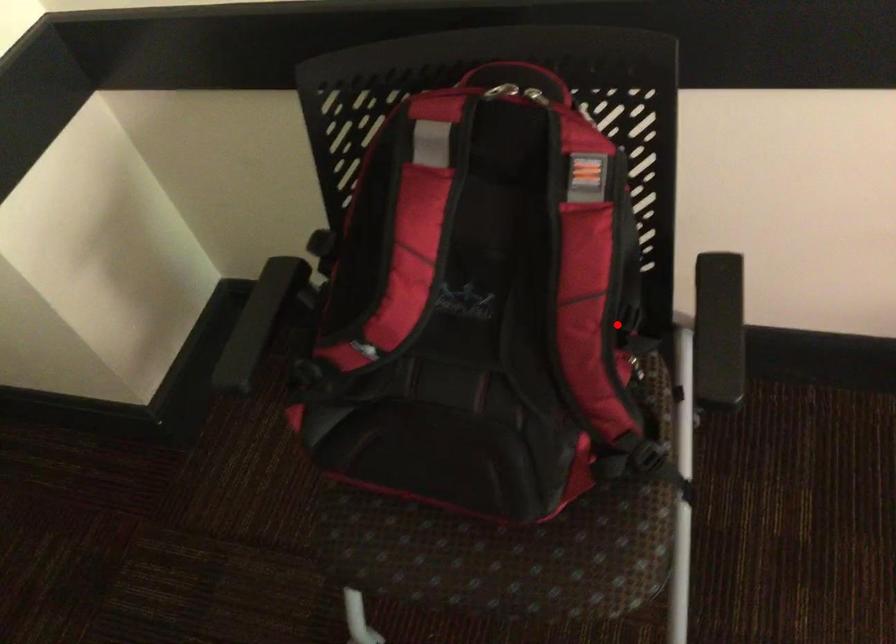
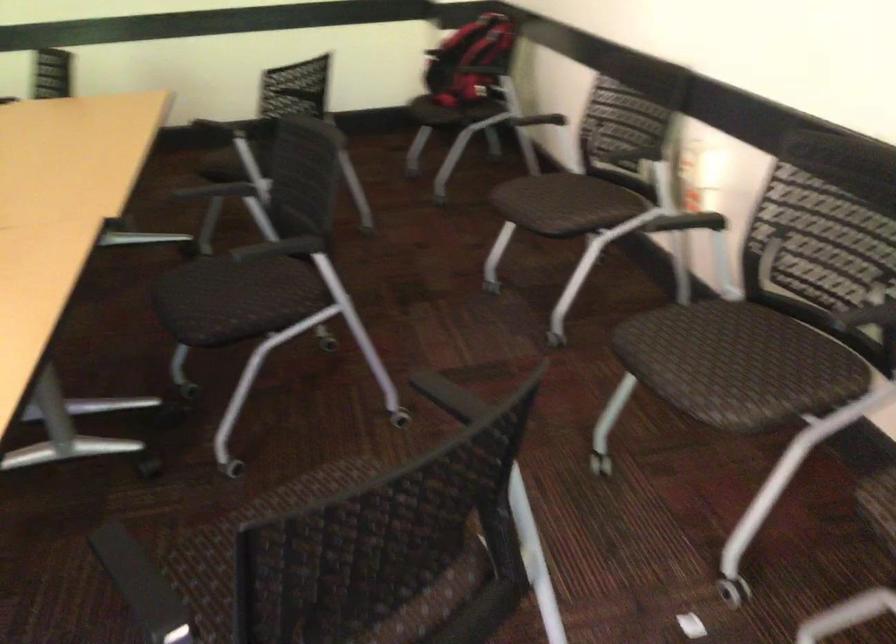
In the second image, find the point that corresponds to the highlighted location in the first image.

(471, 61)